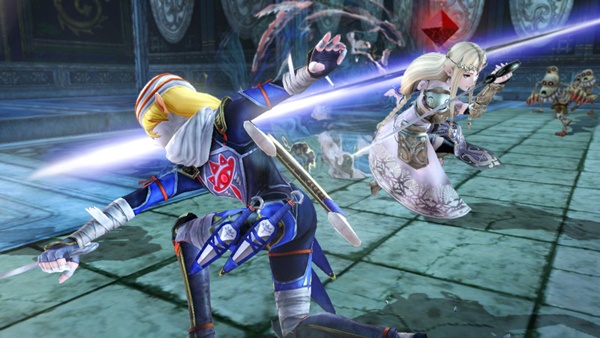
This screenshot has width=600, height=338. Identify the location of green floor. (478, 247).